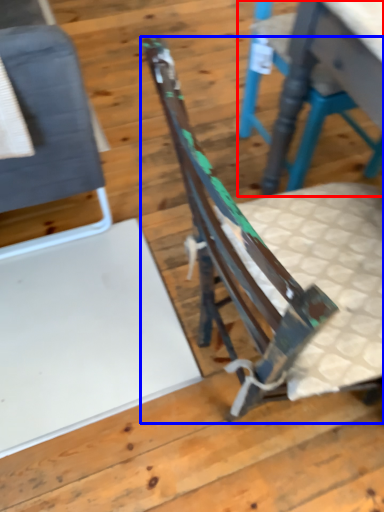
Question: Which point is further to the camera, chair (highlighted by a red box) or chair (highlighted by a blue box)?

Choices:
 (A) chair
 (B) chair

Answer: (A)